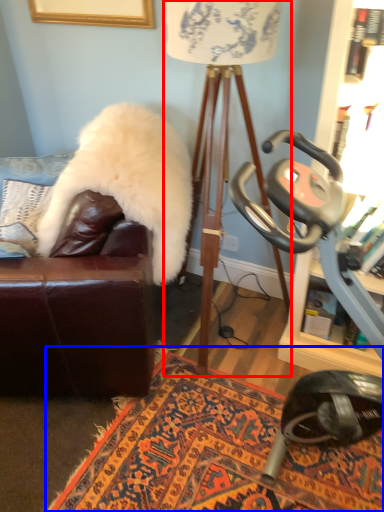
Question: Which object appears farthest to the camera in this image, table lamp (highlighted by a red box) or mat (highlighted by a blue box)?

Choices:
 (A) table lamp
 (B) mat

Answer: (B)